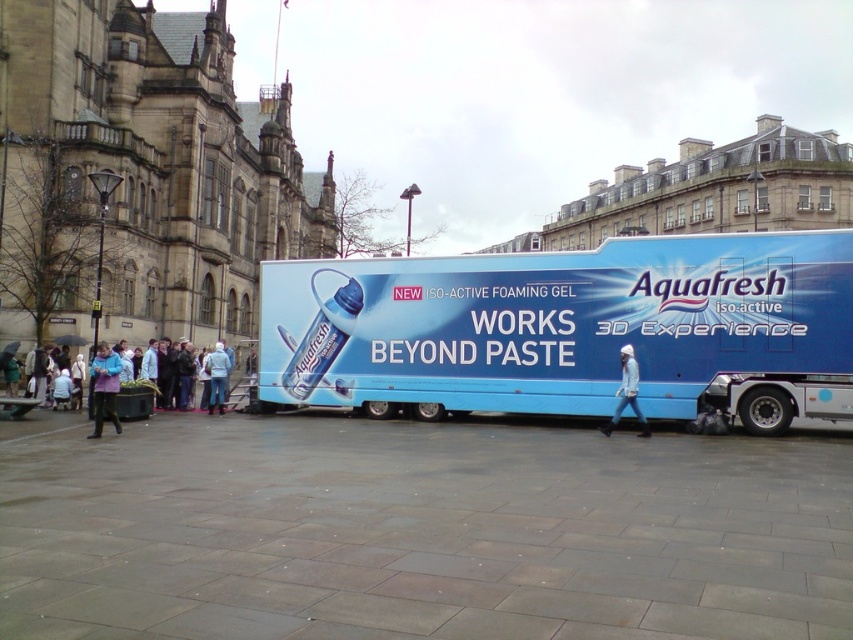
Which is in front, point (103, 342) or point (625, 378)?

Point (625, 378) is more forward.

Does light purple jacket at lower left have a greater width compared to white knit hat at center?

Yes, light purple jacket at lower left is wider than white knit hat at center.

The height and width of the screenshot is (640, 853). Describe the element at coordinates (103, 387) in the screenshot. I see `light purple jacket at lower left` at that location.

Locate an element on the screen. This screenshot has height=640, width=853. light purple jacket at lower left is located at coordinates (103, 387).

Is blue fleece jacket at lower left shorter than white knit hat at center?

Yes, blue fleece jacket at lower left is shorter than white knit hat at center.

Which is more to the left, blue fleece jacket at lower left or white knit hat at center?

From the viewer's perspective, blue fleece jacket at lower left appears more on the left side.

Which is behind, point (0, 416) or point (622, 406)?

Positioned behind is point (0, 416).

At what (x,y) coordinates should I click in order to perform the action: click on blue fleece jacket at lower left. Please return your answer as a coordinate pair (x, y). Looking at the image, I should click on (137, 400).

Between blue glossy bus at center and white fabric jacket at center, which one is positioned higher?

blue glossy bus at center

Does blue glossy bus at center have a lesser width compared to white fabric jacket at center?

Incorrect, blue glossy bus at center's width is not less than white fabric jacket at center's.

Between point (379, 292) and point (218, 358), which one is positioned behind?

The point (218, 358) is behind.

You are a GUI agent. You are given a task and a screenshot of the screen. Output one action in this format:
    pyautogui.click(x=<x>, y=<y>)
    Task: Click on the blue glossy bus at center
    The height and width of the screenshot is (640, 853).
    Given the screenshot: What is the action you would take?
    pyautogui.click(x=572, y=330)